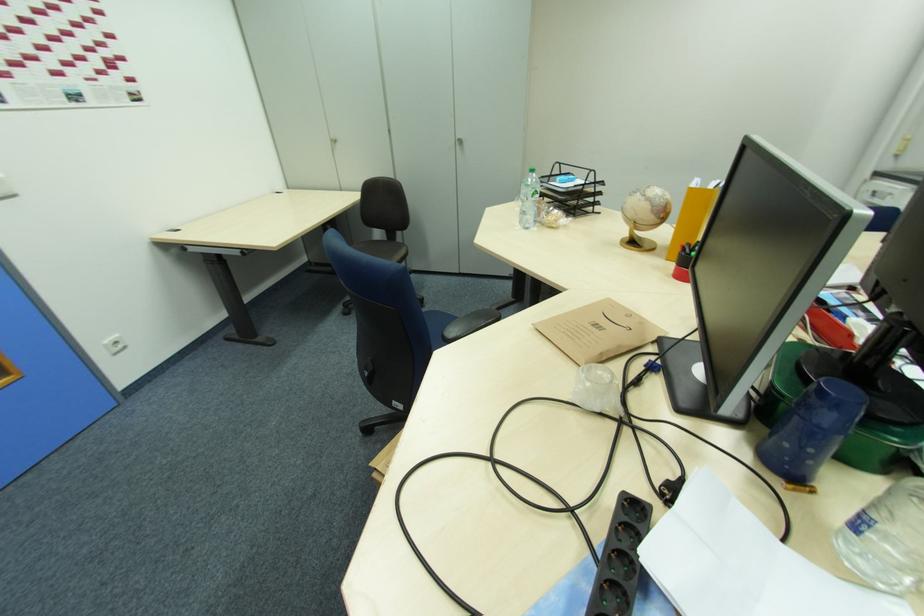
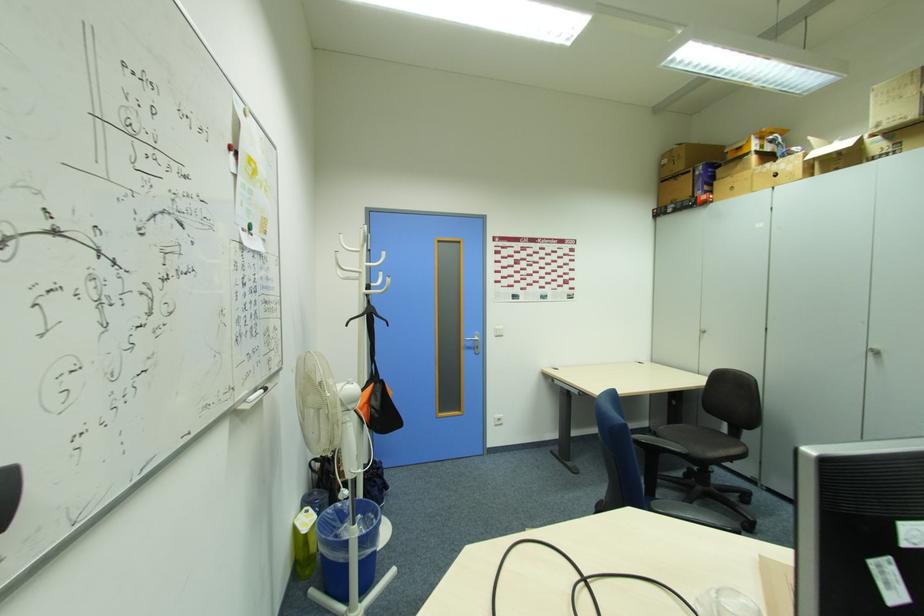
In the second image, find the point that corresponds to point (335, 140) in the first image.

(703, 331)